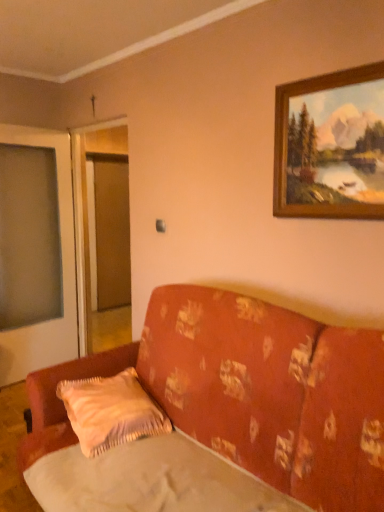
Question: Is fluffy beige pillow at lower center touching wooden frame at upper right?

Choices:
 (A) yes
 (B) no

Answer: (B)

Question: From the image's perspective, does fluffy beige pillow at lower center appear lower than wooden frame at upper right?

Choices:
 (A) yes
 (B) no

Answer: (A)

Question: Could you tell me if fluffy beige pillow at lower center is facing wooden frame at upper right?

Choices:
 (A) yes
 (B) no

Answer: (B)

Question: From a real-world perspective, is fluffy beige pillow at lower center physically below wooden frame at upper right?

Choices:
 (A) yes
 (B) no

Answer: (A)

Question: Is fluffy beige pillow at lower center to the right of wooden frame at upper right from the viewer's perspective?

Choices:
 (A) yes
 (B) no

Answer: (B)

Question: In terms of size, does fluffy beige pillow at lower center appear bigger or smaller than silky beige sheet at lower center?

Choices:
 (A) big
 (B) small

Answer: (B)

Question: Is fluffy beige pillow at lower center to the left or to the right of silky beige sheet at lower center in the image?

Choices:
 (A) right
 (B) left

Answer: (B)

Question: From a real-world perspective, is fluffy beige pillow at lower center physically located above or below silky beige sheet at lower center?

Choices:
 (A) above
 (B) below

Answer: (A)

Question: From their relative heights in the image, would you say fluffy beige pillow at lower center is taller or shorter than silky beige sheet at lower center?

Choices:
 (A) tall
 (B) short

Answer: (A)

Question: Based on their positions, is wooden frame at upper right located to the left or right of transparent glass screen door at left?

Choices:
 (A) right
 (B) left

Answer: (A)

Question: Considering the positions of wooden frame at upper right and transparent glass screen door at left in the image, is wooden frame at upper right bigger or smaller than transparent glass screen door at left?

Choices:
 (A) big
 (B) small

Answer: (B)

Question: In terms of height, does wooden frame at upper right look taller or shorter compared to transparent glass screen door at left?

Choices:
 (A) tall
 (B) short

Answer: (B)

Question: From a real-world perspective, is wooden frame at upper right above or below transparent glass screen door at left?

Choices:
 (A) above
 (B) below

Answer: (A)

Question: Considering their positions, is wooden frame at upper right located in front of or behind fluffy beige pillow at lower center?

Choices:
 (A) front
 (B) behind

Answer: (A)

Question: Visually, is wooden frame at upper right positioned to the left or to the right of fluffy beige pillow at lower center?

Choices:
 (A) right
 (B) left

Answer: (A)